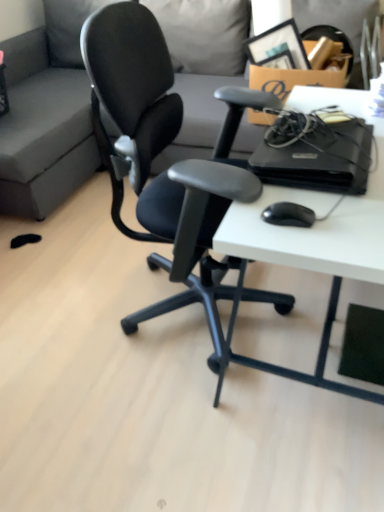
Identify the location of free point to the right of black matte mouse at lower right. This screenshot has width=384, height=512. (349, 214).